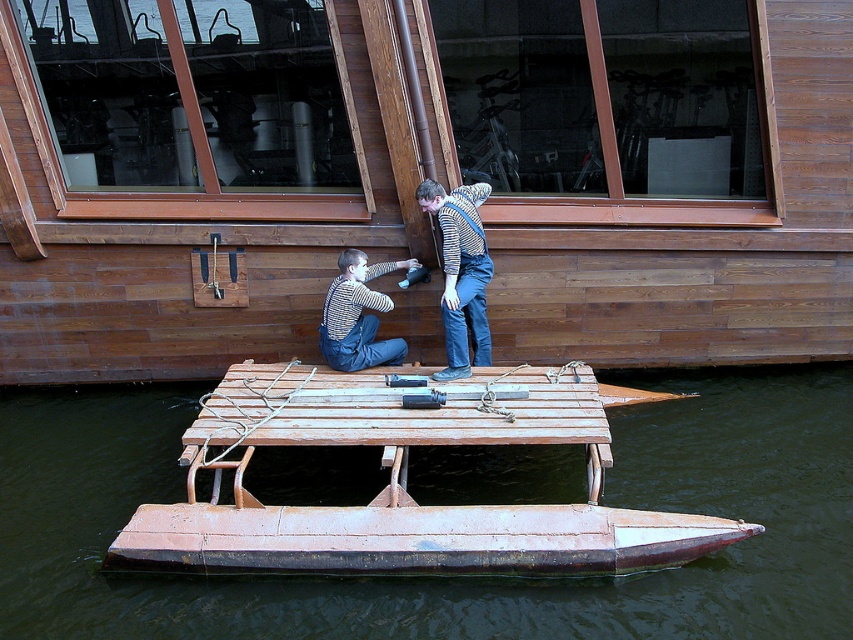
Question: Is striped sweater at center bigger than striped fabric overalls at center?

Choices:
 (A) yes
 (B) no

Answer: (A)

Question: Is wooden at center above striped fabric overalls at center?

Choices:
 (A) yes
 (B) no

Answer: (B)

Question: Which is nearer to the striped sweater at center?

Choices:
 (A) rusty metal raft at center
 (B) striped fabric overalls at center

Answer: (B)

Question: Which point is closer to the camera?

Choices:
 (A) rusty metal raft at center
 (B) striped fabric overalls at center
 (C) wooden at center
 (D) striped sweater at center

Answer: (A)

Question: Among these objects, which one is nearest to the camera?

Choices:
 (A) striped sweater at center
 (B) striped fabric overalls at center
 (C) wooden at center
 (D) rusty metal raft at center

Answer: (D)

Question: Can you confirm if wooden at center is wider than striped fabric overalls at center?

Choices:
 (A) no
 (B) yes

Answer: (B)